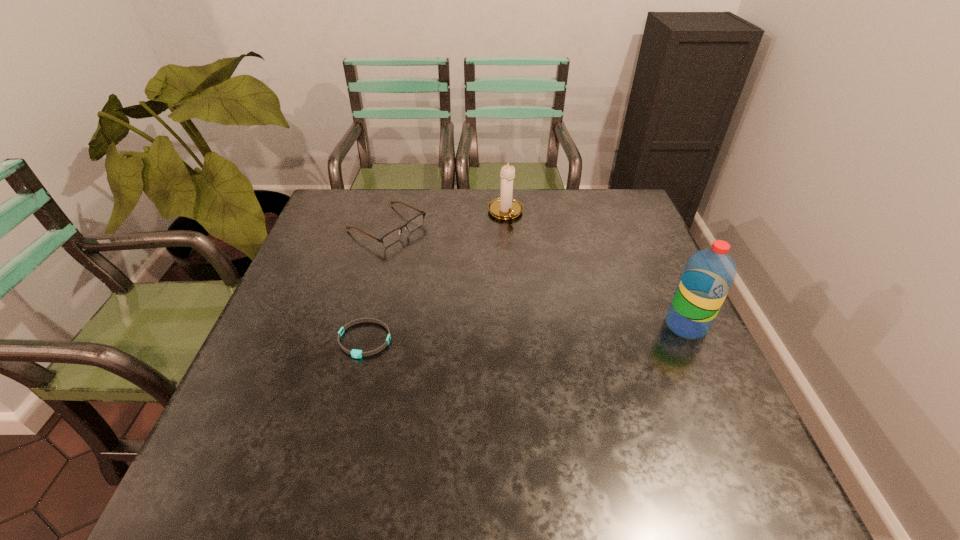
Locate an element on the screen. This screenshot has width=960, height=540. blank area at the left edge is located at coordinates (335, 249).

I want to click on vacant region at the right edge, so click(660, 262).

Locate an element on the screen. vacant space at the far left corner of the desktop is located at coordinates (357, 200).

In order to click on free point between the third tallest object and the second tallest object in this screenshot , I will do `click(446, 219)`.

What are the coordinates of `free space between the second shortest object and the third object from left to right` in the screenshot? It's located at (446, 219).

Locate an element on the screen. free area in between the third object from left to right and the spectacles is located at coordinates [x=446, y=219].

The height and width of the screenshot is (540, 960). In order to click on vacant area that lies between the water bottle and the spectacles in this screenshot , I will do `click(537, 276)`.

Where is `empty space between the candle holder and the wristband`? empty space between the candle holder and the wristband is located at coordinates (435, 276).

Identify the location of vacant area that lies between the shortest object and the third shortest object. This screenshot has width=960, height=540. (435, 276).

You are a GUI agent. You are given a task and a screenshot of the screen. Output one action in this format:
    pyautogui.click(x=<x>, y=<y>)
    Task: Click on the free space that is in between the water bottle and the second object from right to left
    This screenshot has height=540, width=960.
    Given the screenshot: What is the action you would take?
    (x=596, y=269)